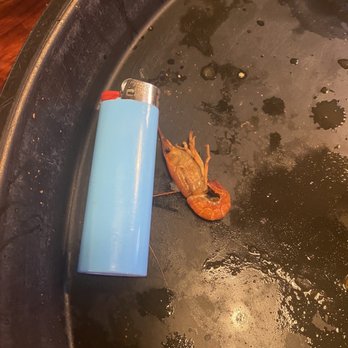
At what (x,y) coordinates should I click in order to perform the action: click on plate. Please return your answer as a coordinate pair (x, y). The width and height of the screenshot is (348, 348). Looking at the image, I should click on (92, 46).